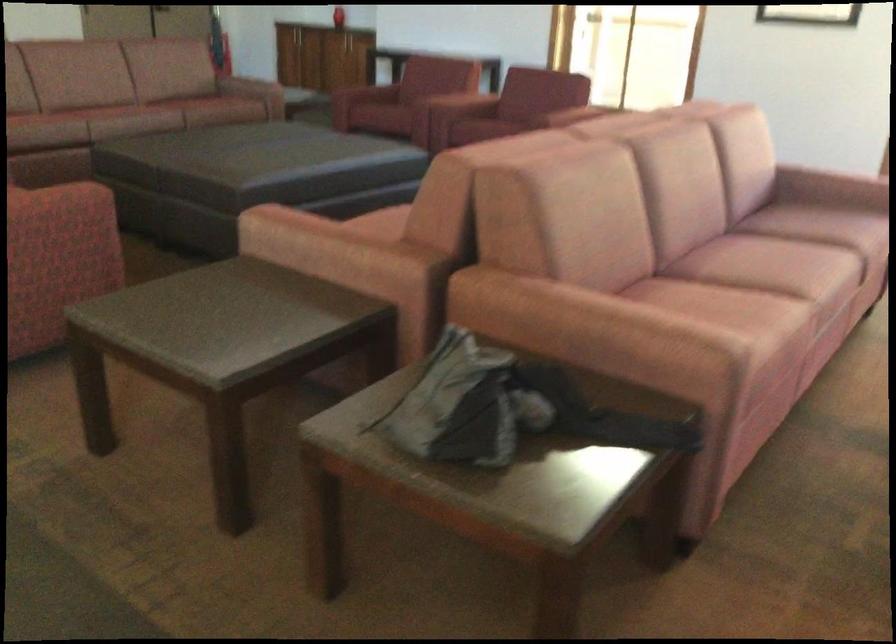
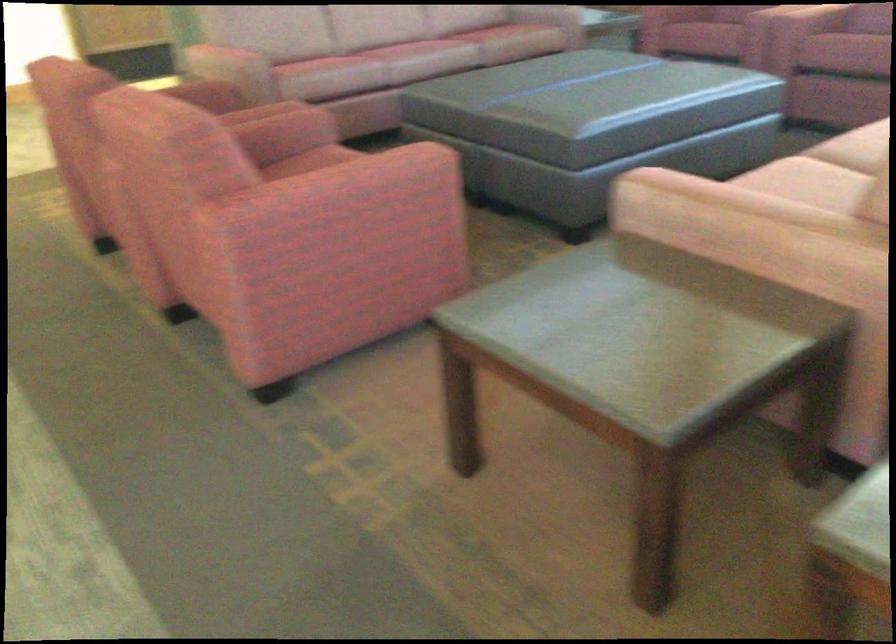
Which direction would the cameraman need to move to produce the second image?

The cameraman walked toward left, forward.